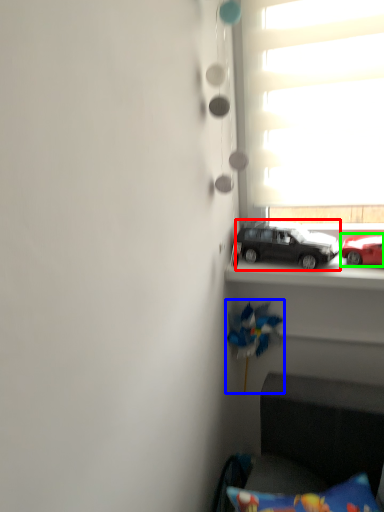
Question: Which object is positioned farthest from car (highlighted by a red box)? Select from toy (highlighted by a blue box) and car (highlighted by a green box).

Choices:
 (A) toy
 (B) car

Answer: (A)